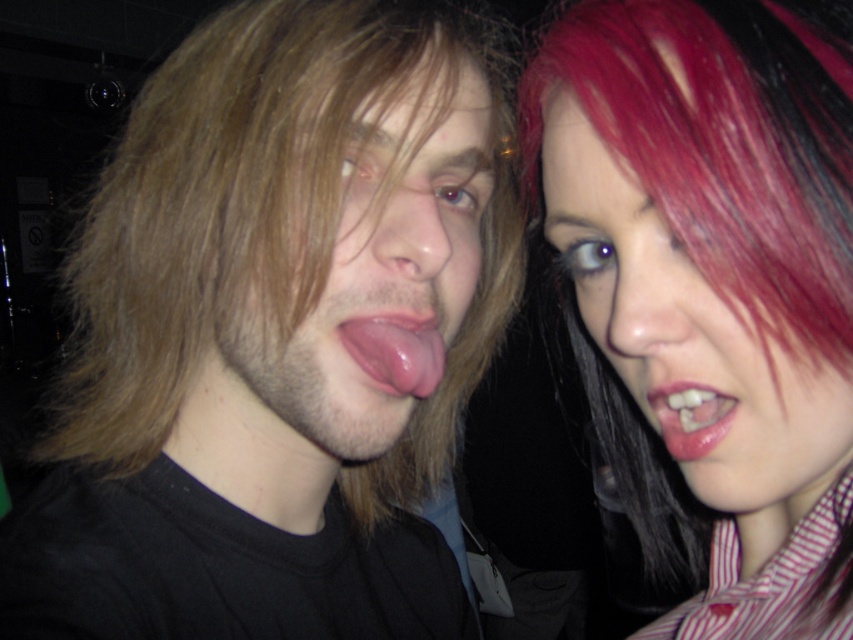
Question: Which of the following is the closest to the observer?

Choices:
 (A) matte skin face at center
 (B) shiny pink hair at upper right
 (C) matte black shirt at left
 (D) glossy pink lips at upper right

Answer: (B)

Question: Can you confirm if pink flesh tongue at center is positioned to the left of glossy pink lips at upper right?

Choices:
 (A) yes
 (B) no

Answer: (A)

Question: Does matte black shirt at left have a greater width compared to glossy pink lips at upper right?

Choices:
 (A) yes
 (B) no

Answer: (A)

Question: Which object appears closest to the camera in this image?

Choices:
 (A) glossy pink lips at upper right
 (B) matte black shirt at left
 (C) matte skin face at center

Answer: (A)

Question: Is matte black shirt at left wider than shiny pink hair at upper right?

Choices:
 (A) yes
 (B) no

Answer: (A)

Question: Which object is positioned farthest from the glossy pink lips at upper right?

Choices:
 (A) matte black shirt at left
 (B) matte skin face at center
 (C) shiny pink hair at upper right

Answer: (A)